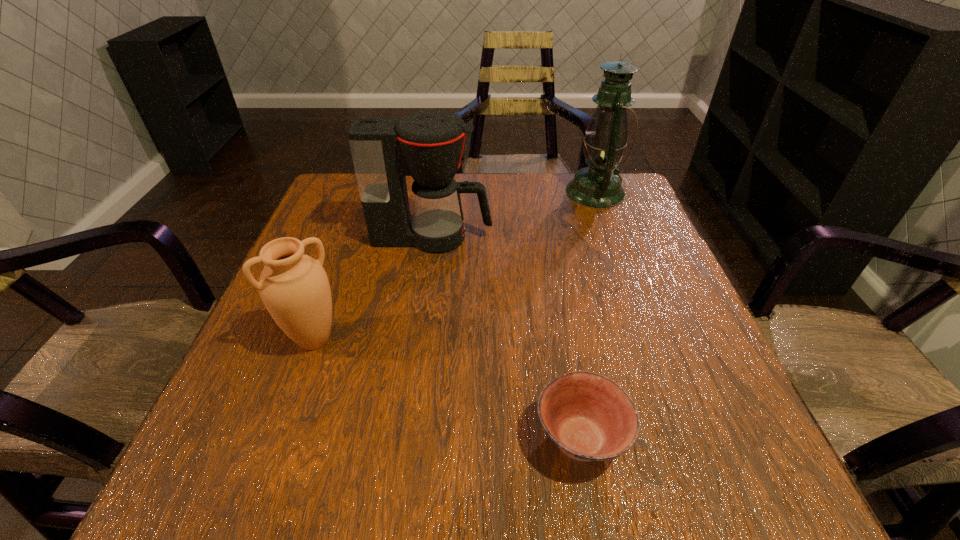
Where is `vacant space that's between the second object from right to left and the third farthest object`? This screenshot has width=960, height=540. vacant space that's between the second object from right to left and the third farthest object is located at coordinates (447, 389).

In order to click on blank region between the oil lamp and the nearest object in this screenshot , I will do `click(588, 315)`.

Identify the location of unoccupied position between the third farthest object and the shortest object. The width and height of the screenshot is (960, 540). (447, 389).

What are the coordinates of `free space between the second shortest object and the oil lamp` in the screenshot? It's located at (455, 266).

This screenshot has height=540, width=960. Find the location of `object that can be found as the third closest to the second tallest object`. object that can be found as the third closest to the second tallest object is located at coordinates (588, 416).

The height and width of the screenshot is (540, 960). What are the coordinates of `object that stands as the closest to the bowl` in the screenshot? It's located at (294, 287).

You are a GUI agent. You are given a task and a screenshot of the screen. Output one action in this format:
    pyautogui.click(x=<x>, y=<y>)
    Task: Click on the vacant region that satisfies the following two spatial constraints: 1. on the back side of the bowl; 2. on the left side of the oil lamp
    Image resolution: width=960 pixels, height=540 pixels.
    Given the screenshot: What is the action you would take?
    pyautogui.click(x=537, y=192)

The image size is (960, 540). What are the coordinates of `vacant space that satisfies the following two spatial constraints: 1. pour from the carafe of the third shortest object; 2. on the back side of the bowl` in the screenshot? It's located at (405, 438).

You are a GUI agent. You are given a task and a screenshot of the screen. Output one action in this format:
    pyautogui.click(x=<x>, y=<y>)
    Task: Click on the free location that satisfies the following two spatial constraints: 1. pour from the carafe of the coffee maker; 2. on the right side of the nearest object
    
    Given the screenshot: What is the action you would take?
    pyautogui.click(x=405, y=438)

Locate an element on the screen. Image resolution: width=960 pixels, height=540 pixels. vacant region that satisfies the following two spatial constraints: 1. pour from the carafe of the second object from right to left; 2. on the left side of the third shortest object is located at coordinates (405, 438).